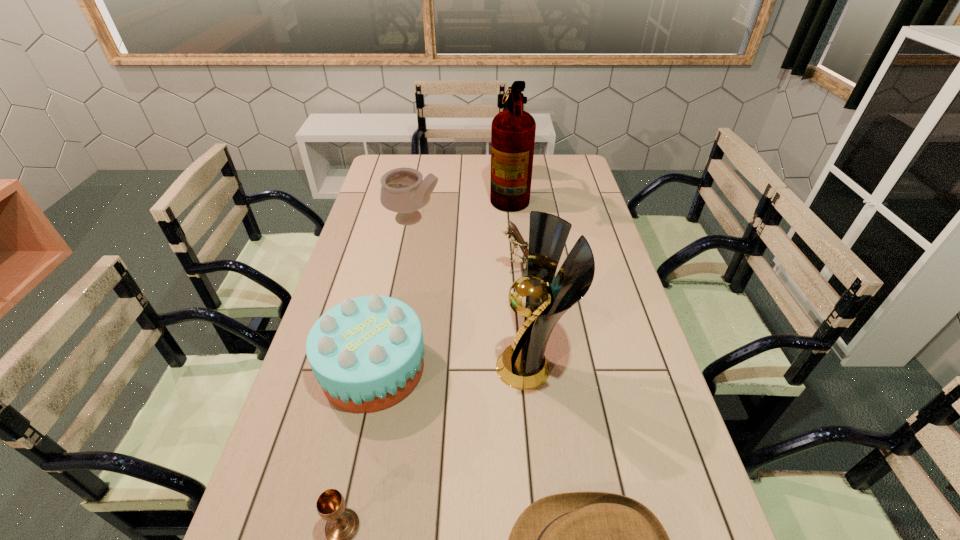
Find the location of a particular element. vacant region at the left edge of the desktop is located at coordinates (370, 224).

In the image, there is a desktop. At what (x,y) coordinates should I click in order to perform the action: click on vacant space at the right edge. Please return your answer as a coordinate pair (x, y). Looking at the image, I should click on (615, 317).

Locate an element on the screen. The width and height of the screenshot is (960, 540). vacant area at the far left corner of the desktop is located at coordinates (394, 160).

I want to click on free space at the far right corner of the desktop, so click(x=575, y=180).

The image size is (960, 540). In order to click on empty location between the tallest object and the third shortest object in this screenshot , I will do `click(442, 281)`.

Where is `vacant area between the figurine and the pottery`? The width and height of the screenshot is (960, 540). vacant area between the figurine and the pottery is located at coordinates (470, 246).

The width and height of the screenshot is (960, 540). In order to click on vacant area between the third shortest object and the award in this screenshot , I will do `click(453, 367)`.

Select which object appears as the third closest to the fedora. Please provide its 2D coordinates. Your answer should be formatted as a tuple, i.e. [(x, y)], where the tuple contains the x and y coordinates of a point satisfying the conditions above.

[(342, 524)]

Identify the location of the closest object to the third shortest object. Image resolution: width=960 pixels, height=540 pixels. (522, 365).